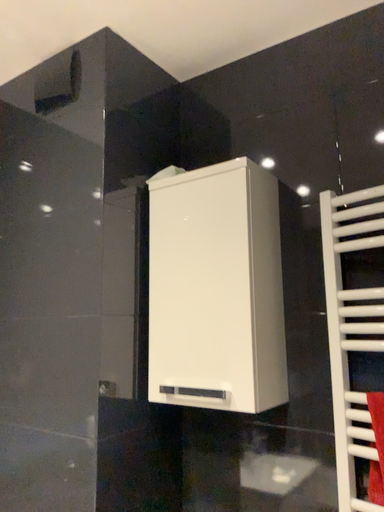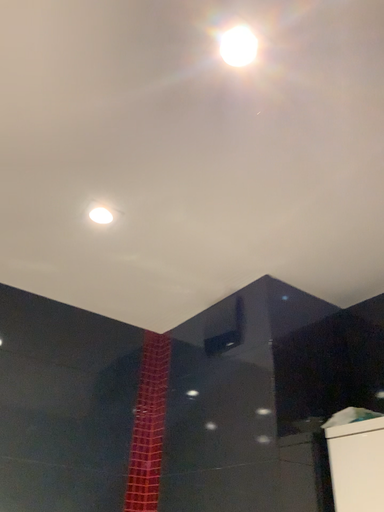
Question: How did the camera likely rotate when shooting the video?

Choices:
 (A) rotated upward
 (B) rotated downward

Answer: (A)